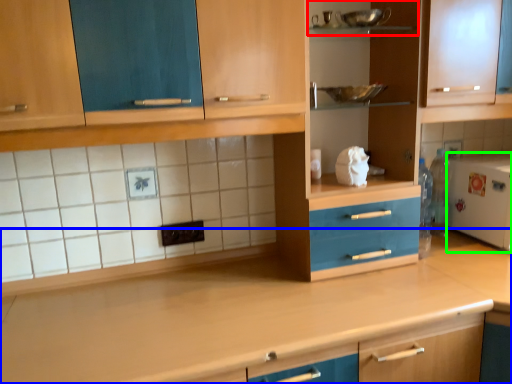
Question: Estimate the real-world distances between objects in this image. Which object is farther from shelf (highlighted by a red box), countertop (highlighted by a blue box) or appliance (highlighted by a green box)?

Choices:
 (A) countertop
 (B) appliance

Answer: (A)